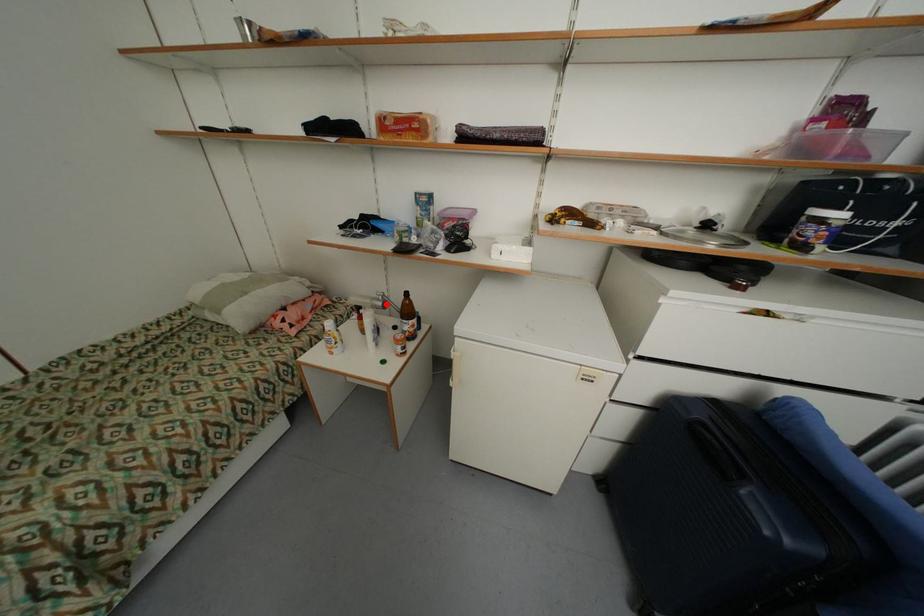
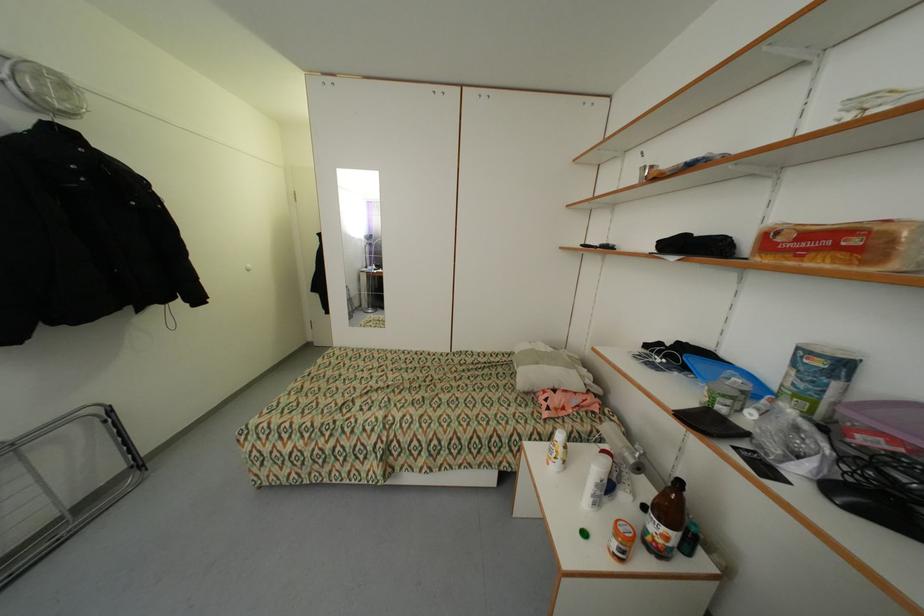
Find the pixel in the second image that matches the highlighted location in the first image.

(638, 462)